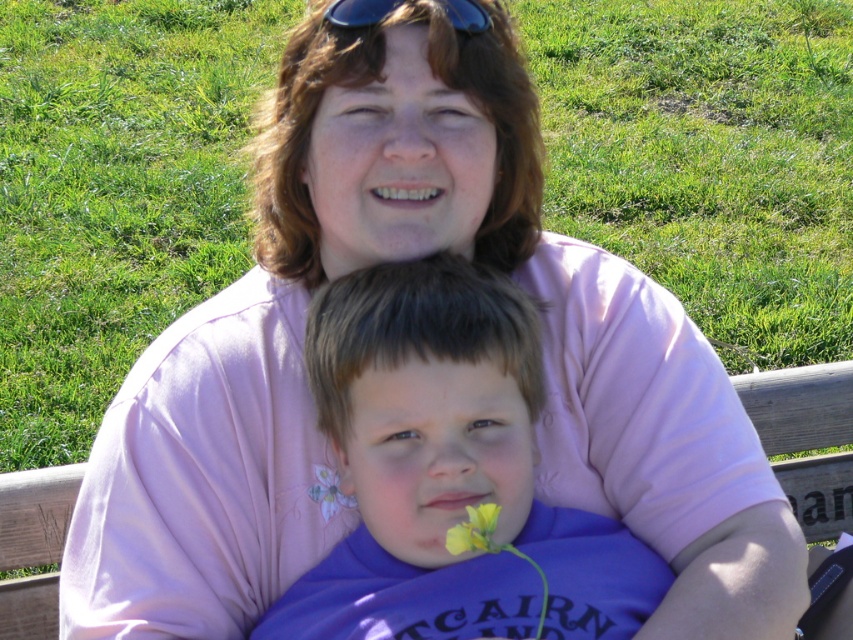
You are a photographer trying to capture the yellow matte flower at lower center in the image. The flower is located at coordinates point 0.831, 0.557. If your camera has a zoom lens that can focus on objects within a 0.2 radius from the center, will the flower be in focus?

The yellow matte flower at lower center is located at point (474, 531). Since the camera can focus within a 0.2 radius from the center, the distance from the center to the flower is sqrt? Wait, but the question says to use the coordinates to determine if it is within 0.2 radius. Let me calculate the distance from the center point. The center is at (426, 320). The flower is at (474, 531). The distance would be sqrt? Wait, but the question says to use the coordinates to determine if it is within 0.2 radius.

You are a photographer setting up a shot of the scene. You notice the purple fabric at center and the blue plastic sunglasses at upper center. Which object should you focus on first if you want to capture the larger object in your frame?

The purple fabric at center is larger than the blue plastic sunglasses at upper center, so you should focus on the purple fabric at center first to capture the larger object in your frame.